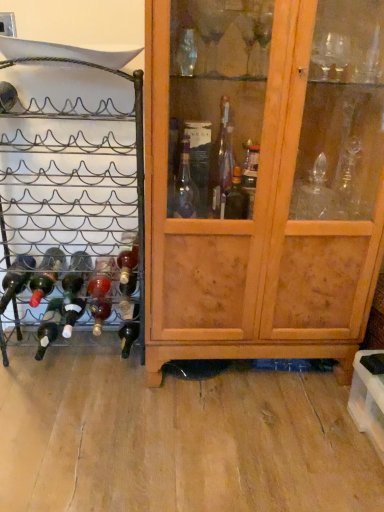
Question: Should I look upward or downward to see matte dark brown bottle at lower left, the second bottle when ordered from left to right?

Choices:
 (A) up
 (B) down

Answer: (B)

Question: Is matte glass bottle at left, the third bottle in the left-to-right sequence, smaller than matte dark brown bottle at lower left, the second bottle when ordered from left to right?

Choices:
 (A) yes
 (B) no

Answer: (B)

Question: Does matte glass bottle at left, the third bottle in the left-to-right sequence, have a greater height compared to matte dark brown bottle at lower left, which is the sixth bottle from right to left?

Choices:
 (A) yes
 (B) no

Answer: (B)

Question: Does matte glass bottle at left, the third bottle in the left-to-right sequence, lie in front of matte dark brown bottle at lower left, which is the sixth bottle from right to left?

Choices:
 (A) yes
 (B) no

Answer: (A)

Question: From a real-world perspective, is matte glass bottle at left, the third bottle in the left-to-right sequence, below matte dark brown bottle at lower left, which is the sixth bottle from right to left?

Choices:
 (A) no
 (B) yes

Answer: (A)

Question: Would you consider matte glass bottle at left, placed as the 5th bottle when sorted from right to left, to be distant from matte dark brown bottle at lower left, the second bottle when ordered from left to right?

Choices:
 (A) yes
 (B) no

Answer: (B)

Question: Is matte dark brown bottle at lower left, which is the sixth bottle from right to left, a part of matte glass bottle at left, placed as the 5th bottle when sorted from right to left?

Choices:
 (A) yes
 (B) no

Answer: (B)

Question: From a real-world perspective, does matte black wine bottle at left, positioned as the seventh bottle in right-to-left order, sit lower than translucent glass bottle at center?

Choices:
 (A) no
 (B) yes

Answer: (A)

Question: Can you confirm if matte black wine bottle at left, which is counted as the first bottle, starting from the left, is positioned to the right of translucent glass bottle at center?

Choices:
 (A) no
 (B) yes

Answer: (A)

Question: Is matte black wine bottle at left, positioned as the seventh bottle in right-to-left order, positioned with its back to translucent glass bottle at center?

Choices:
 (A) yes
 (B) no

Answer: (B)

Question: From the image's perspective, would you say matte black wine bottle at left, positioned as the seventh bottle in right-to-left order, is positioned over translucent glass bottle at center?

Choices:
 (A) no
 (B) yes

Answer: (B)

Question: Is translucent glass bottle at center surrounded by matte black wine bottle at left, which is counted as the first bottle, starting from the left?

Choices:
 (A) no
 (B) yes

Answer: (A)

Question: Does matte black wine bottle at left, positioned as the seventh bottle in right-to-left order, have a lesser height compared to translucent glass bottle at center?

Choices:
 (A) yes
 (B) no

Answer: (A)

Question: From a real-world perspective, is translucent glass bottle at center positioned under matte glass bottle at lower left, the 5th bottle when ordered from left to right, based on gravity?

Choices:
 (A) yes
 (B) no

Answer: (A)